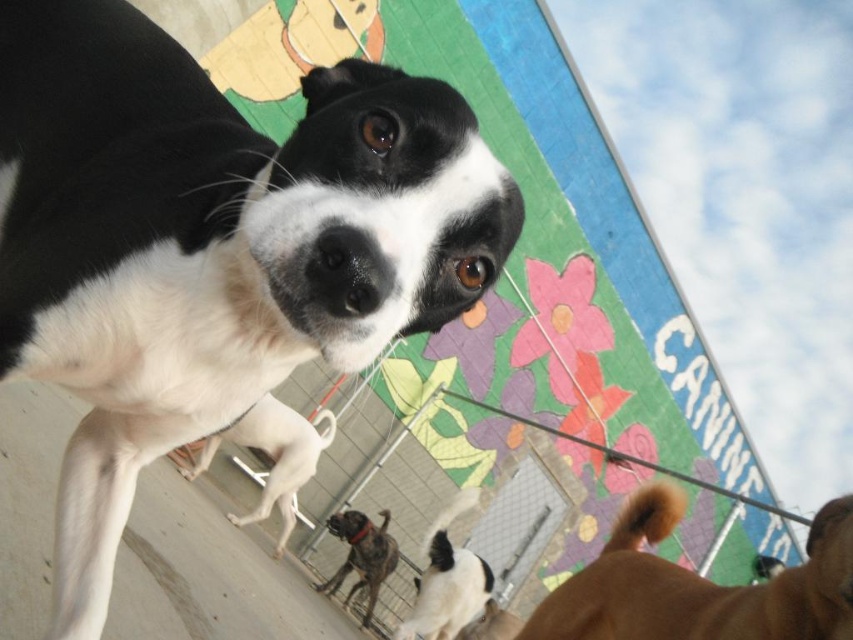
Question: Does brown fur tail at lower right have a lesser width compared to white smooth dog at center?

Choices:
 (A) yes
 (B) no

Answer: (A)

Question: Based on their relative distances, which object is farther from the white fur dog at lower center?

Choices:
 (A) black matte nose at center
 (B) black and white fur at center
 (C) brindle fur dog at center
 (D) brown fur tail at lower right

Answer: (A)

Question: Which point is farther to the camera?

Choices:
 (A) (363, 308)
 (B) (270, 433)
 (C) (44, 278)

Answer: (B)

Question: Can you confirm if white fur dog at lower center is smaller than black matte nose at center?

Choices:
 (A) yes
 (B) no

Answer: (B)

Question: Which of the following is the closest to the observer?

Choices:
 (A) black and white fur at center
 (B) black matte nose at center
 (C) white fur dog at lower center

Answer: (B)

Question: Does brown fur tail at lower right appear on the right side of brindle fur dog at center?

Choices:
 (A) yes
 (B) no

Answer: (A)